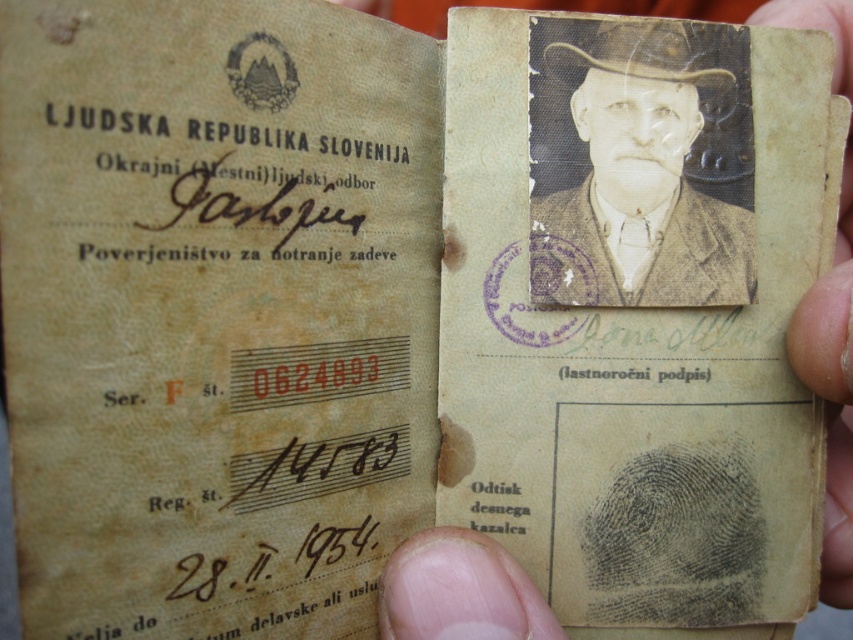
Can you confirm if black textured hat at upper center is taller than flesh-toned skin at lower right?

No.

Is black textured hat at upper center to the left of flesh-toned skin at lower right from the viewer's perspective?

Indeed, black textured hat at upper center is positioned on the left side of flesh-toned skin at lower right.

This screenshot has height=640, width=853. Find the location of `black textured hat at upper center`. black textured hat at upper center is located at coordinates (640, 163).